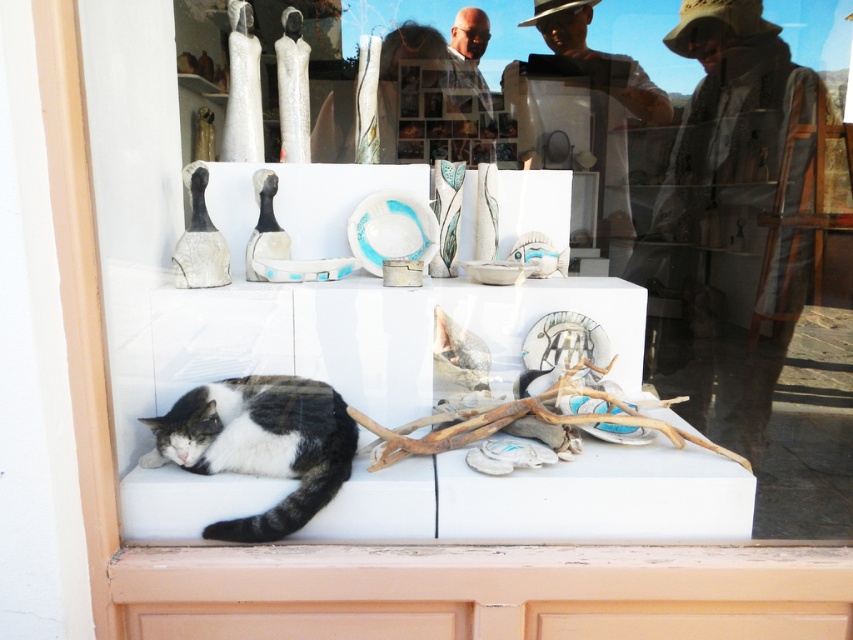
Between black-and-white fur cat at lower left and natural wood driftwood at center, which one is positioned lower?

black-and-white fur cat at lower left is lower down.

The width and height of the screenshot is (853, 640). Describe the element at coordinates (260, 444) in the screenshot. I see `black-and-white fur cat at lower left` at that location.

Identify the location of black-and-white fur cat at lower left. This screenshot has height=640, width=853. (260, 444).

The height and width of the screenshot is (640, 853). What are the coordinates of `black-and-white fur cat at lower left` in the screenshot? It's located at (260, 444).